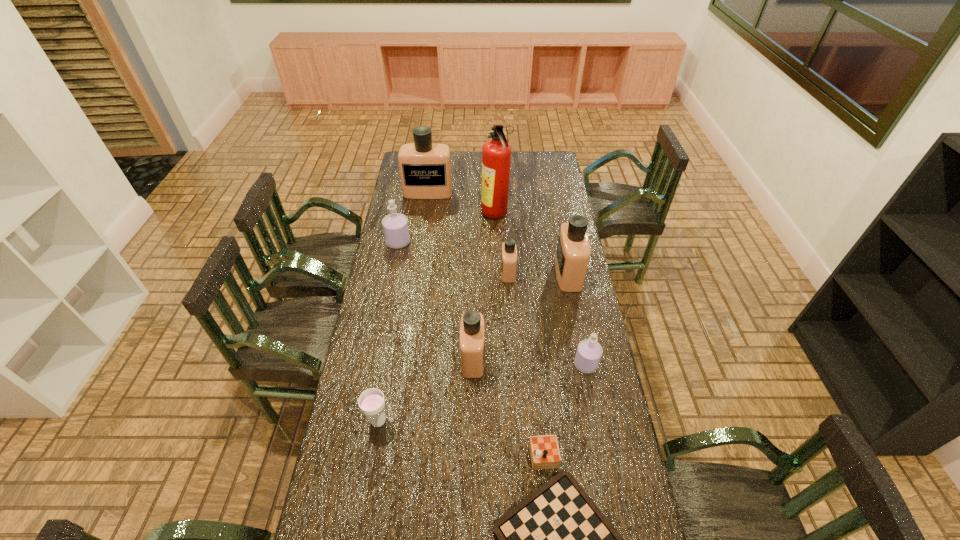
At what (x,y) coordinates should I click in order to perform the action: click on red fire extinguisher. Please return your answer as a coordinate pair (x, y). The image size is (960, 540). Looking at the image, I should click on (496, 153).

I want to click on the tallest object, so click(496, 153).

Locate an element on the screen. The width and height of the screenshot is (960, 540). the farthest object is located at coordinates (425, 168).

Identify the location of the leftmost beige perfume. (425, 168).

Locate an element on the screen. the second biggest beige perfume is located at coordinates (573, 252).

The width and height of the screenshot is (960, 540). I want to click on the seventh shortest object, so click(x=573, y=252).

I want to click on the second farthest perfume, so click(x=395, y=225).

This screenshot has height=540, width=960. In order to click on the bigger purple perfume in this screenshot , I will do point(395,225).

Where is `the third perfume from left to right`? The image size is (960, 540). the third perfume from left to right is located at coordinates (472, 331).

At what (x,y) coordinates should I click in order to perform the action: click on the third beige perfume from right to left. Please return your answer as a coordinate pair (x, y). This screenshot has height=540, width=960. Looking at the image, I should click on (472, 331).